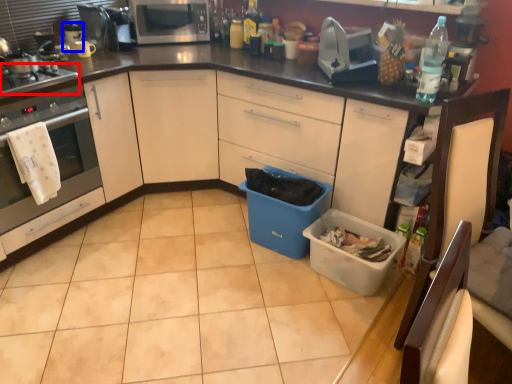
Question: Which object appears closest to the camera in this image, gas stove (highlighted by a red box) or appliance (highlighted by a blue box)?

Choices:
 (A) gas stove
 (B) appliance

Answer: (A)